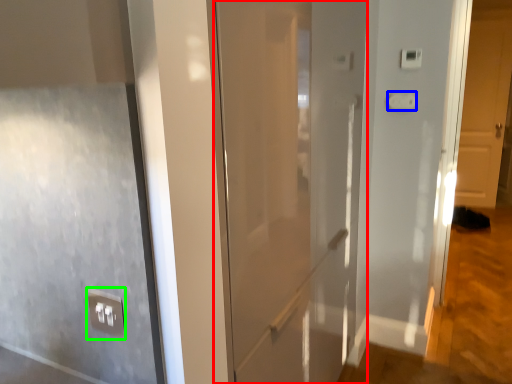
Question: Which is farther away from door (highlighted by a red box)? light switch (highlighted by a blue box) or electric outlet (highlighted by a green box)?

Choices:
 (A) light switch
 (B) electric outlet

Answer: (A)